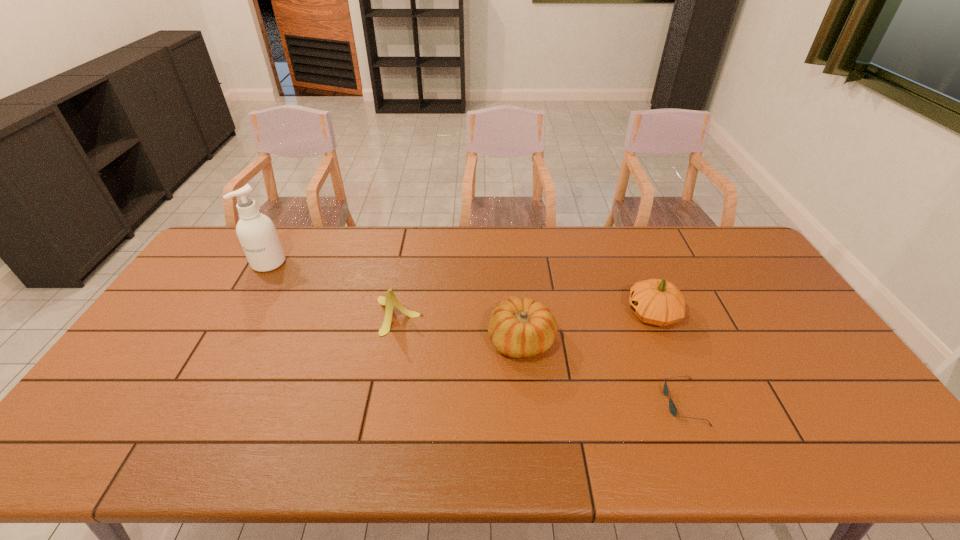
Find the location of a particular element. This screenshot has width=960, height=540. the farthest object is located at coordinates (256, 232).

The width and height of the screenshot is (960, 540). I want to click on the tallest object, so click(x=256, y=232).

Locate an element on the screen. the right gourd is located at coordinates (659, 302).

At what (x,y) coordinates should I click in order to perform the action: click on banana. Please return your answer as a coordinate pair (x, y). Image resolution: width=960 pixels, height=540 pixels. Looking at the image, I should click on (390, 300).

Find the location of a particular element. The width and height of the screenshot is (960, 540). the left gourd is located at coordinates (520, 328).

Identify the location of the shortest object. This screenshot has width=960, height=540. (673, 410).

Where is `the nearest object`? The height and width of the screenshot is (540, 960). the nearest object is located at coordinates (673, 410).

Locate an element on the screen. This screenshot has width=960, height=540. vacant position located on the front label of the tallest object is located at coordinates (250, 296).

Where is `free space located on the side of the right gourd with the carved face`? Image resolution: width=960 pixels, height=540 pixels. free space located on the side of the right gourd with the carved face is located at coordinates (576, 314).

The image size is (960, 540). In order to click on free spot located 0.220m on the side of the right gourd with the carved face in this screenshot , I will do `click(553, 314)`.